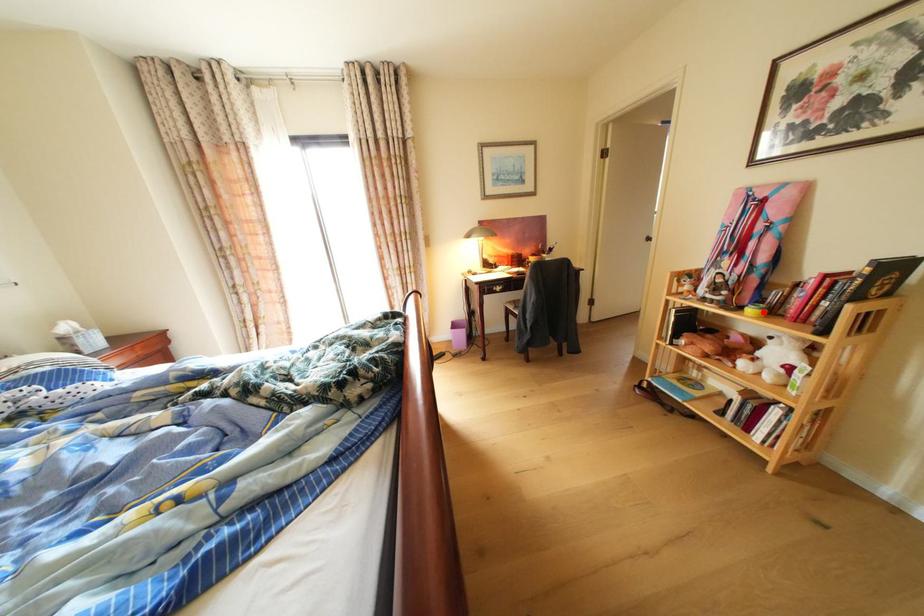
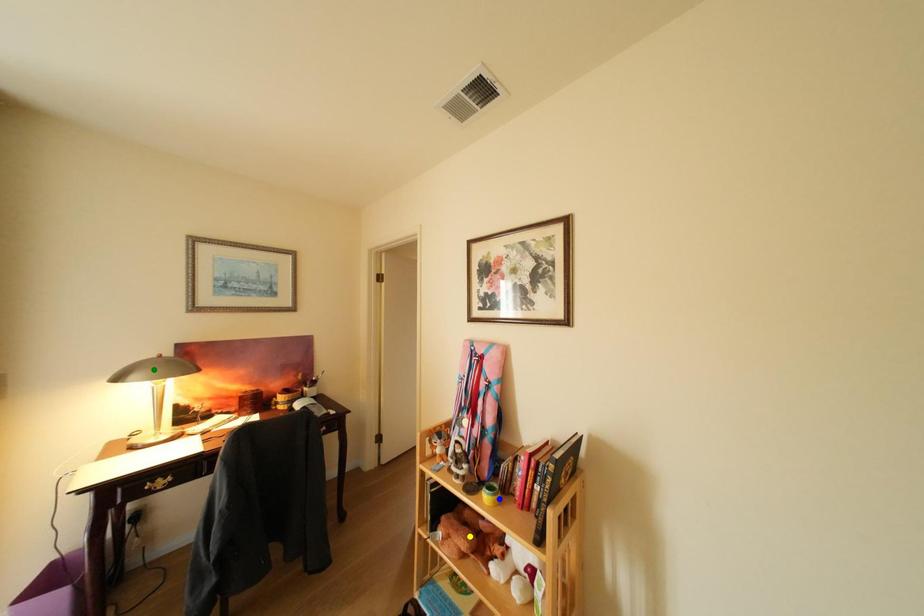
Question: I am providing you with two images of the same scene from different viewpoints. A red point is marked on the first image. You are given multiple points on the second image. Which mark in image 2 goes with the point in image 1?

Choices:
 (A) blue point
 (B) yellow point
 (C) green point

Answer: (A)